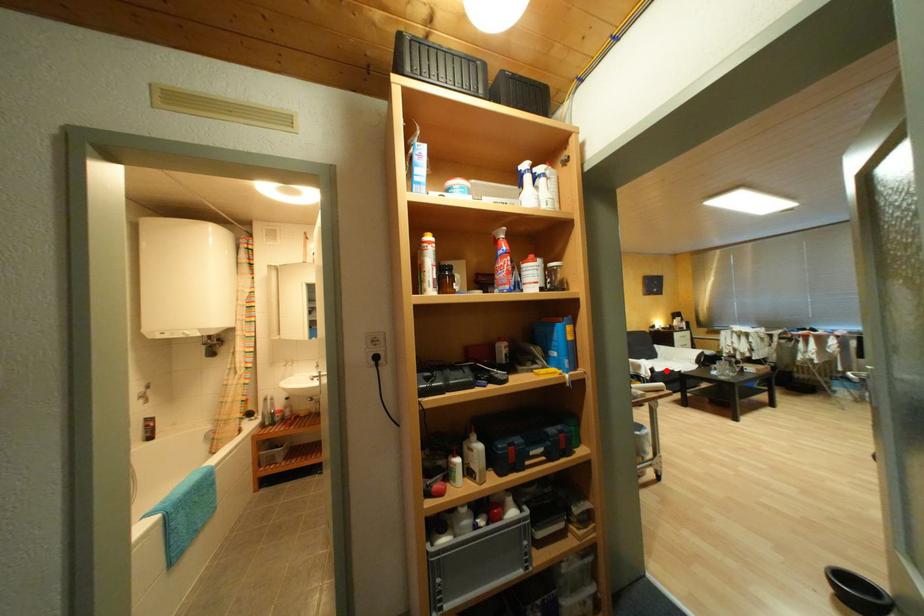
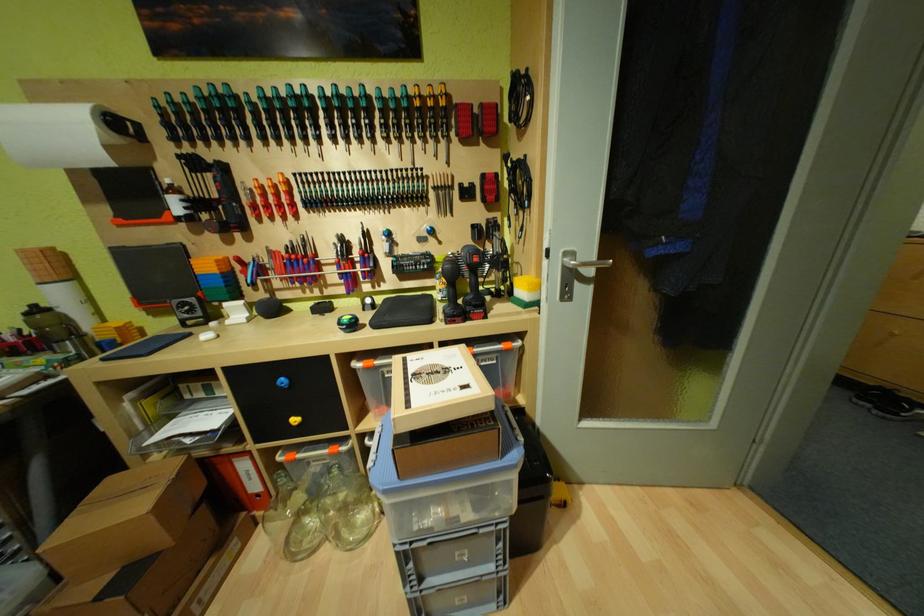
Question: I am providing you with two images of the same scene from different viewpoints. A red point is marked on the first image. Can you still see the location of the red point in image 2?

Choices:
 (A) Yes
 (B) No

Answer: (B)